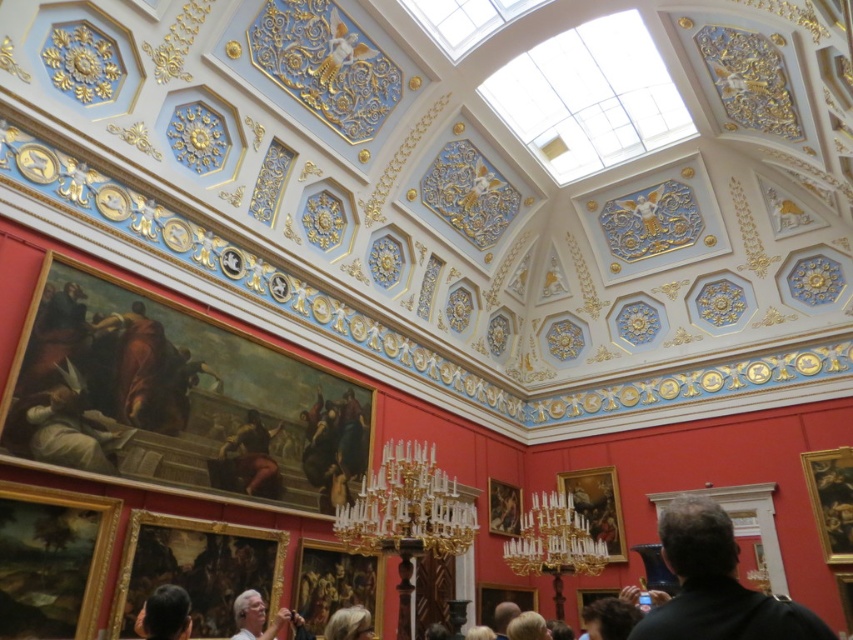
You are an artist standing in the gallery and you want to touch the white hair at lower center. According to the coordinates provided, where should you move your hand to reach it?

You should move your hand to point 0.966 on the x axis and 0.304 on the y axis to reach the white hair at lower center.

You are an art restorer working in the gallery. You notice a black leather jacket at lower right and a white hair at lower center. Which object is covering the other?

The black leather jacket at lower right is positioned over the white hair at lower center, so it is covering it.

You are an art restorer examining two portraits in the gallery. The portraits feature a person with white hair at lower center and another with blonde hair at lower center. Which portrait has hair that is shorter?

The white hair at lower center is shorter than the blonde hair at lower center, so the portrait with white hair at lower center has shorter hair.